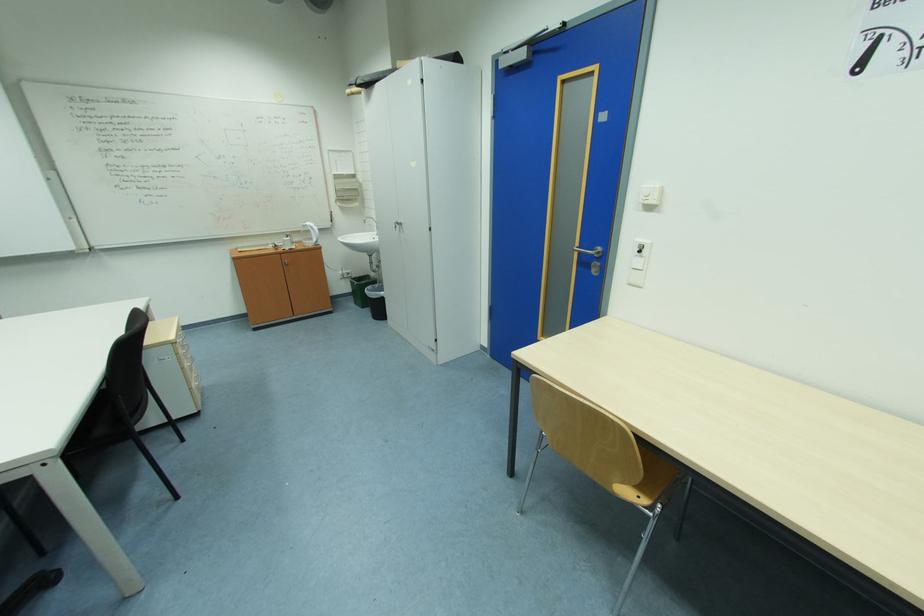
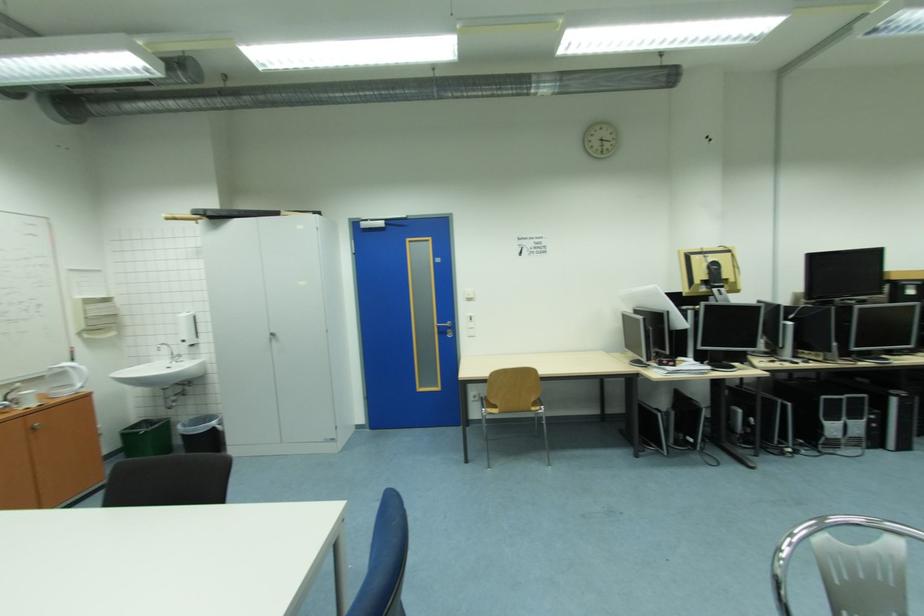
The point at [360,280] is marked in the first image. Where is the corresponding point in the second image?

(130, 431)